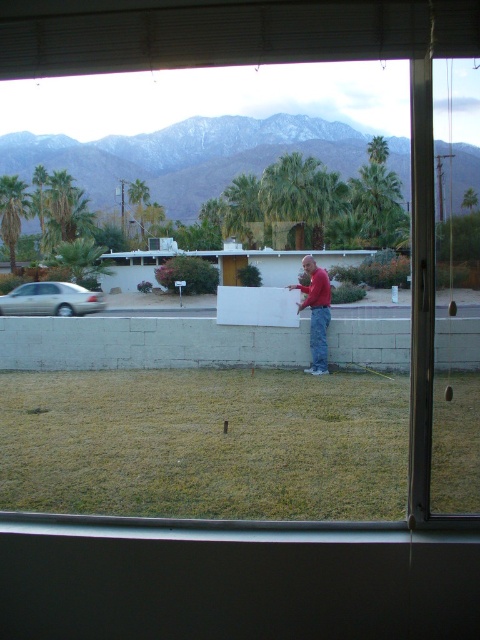
You are standing inside a building looking through the window. You see a green leafy palm tree at upper center and a gold metallic sedan at left. Which object appears taller in the scene?

The gold metallic sedan at left appears taller than the green leafy palm tree at upper center.

You are standing inside the building looking through the window. You see the green grass at lower center and the red cotton shirt at center. Which object is closer to the bottom edge of the window?

The green grass at lower center is closer to the bottom edge of the window because it is located below the red cotton shirt at center.